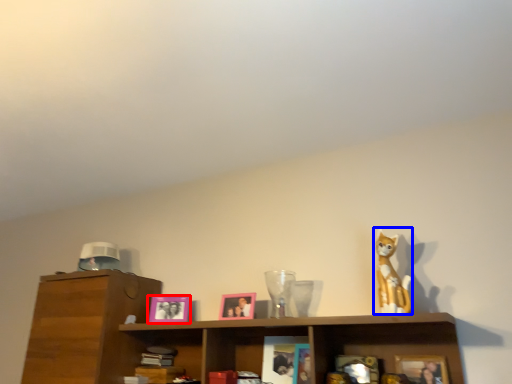
Question: Which object appears farthest to the camera in this image, picture frame (highlighted by a red box) or toy (highlighted by a blue box)?

Choices:
 (A) picture frame
 (B) toy

Answer: (A)